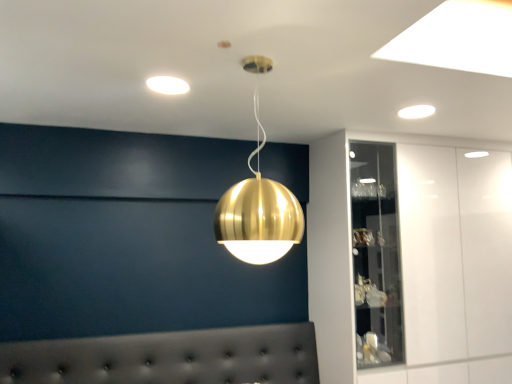
Question: From a real-world perspective, is white glossy cabinet at upper right on top of tufted leather headboard at lower center?

Choices:
 (A) no
 (B) yes

Answer: (B)

Question: Does white glossy cabinet at upper right have a lesser height compared to tufted leather headboard at lower center?

Choices:
 (A) yes
 (B) no

Answer: (B)

Question: Is the position of white glossy cabinet at upper right less distant than that of tufted leather headboard at lower center?

Choices:
 (A) no
 (B) yes

Answer: (A)

Question: From the image's perspective, is white glossy cabinet at upper right over tufted leather headboard at lower center?

Choices:
 (A) no
 (B) yes

Answer: (B)

Question: Is the position of white glossy cabinet at upper right more distant than that of tufted leather headboard at lower center?

Choices:
 (A) yes
 (B) no

Answer: (A)

Question: Would you say gold metallic sphere at center, which is the first lamp from bottom to top, is inside or outside tufted leather headboard at lower center?

Choices:
 (A) inside
 (B) outside

Answer: (B)

Question: Considering the positions of point (268, 226) and point (77, 375), is point (268, 226) closer or farther from the camera than point (77, 375)?

Choices:
 (A) closer
 (B) farther

Answer: (A)

Question: Is gold metallic sphere at center, which is the first lamp from front to back, bigger or smaller than tufted leather headboard at lower center?

Choices:
 (A) big
 (B) small

Answer: (B)

Question: Relative to tufted leather headboard at lower center, is gold metallic sphere at center, which is the first lamp from bottom to top, in front or behind?

Choices:
 (A) front
 (B) behind

Answer: (A)

Question: From their relative heights in the image, would you say white glossy light fixture at upper right, acting as the first lamp starting from the right, is taller or shorter than matte white light fixture at upper center, which is the third lamp from right to left?

Choices:
 (A) tall
 (B) short

Answer: (A)

Question: Is white glossy light fixture at upper right, the first lamp viewed from the back, wider or thinner than matte white light fixture at upper center, which is the third lamp from right to left?

Choices:
 (A) wide
 (B) thin

Answer: (B)

Question: Would you say white glossy light fixture at upper right, acting as the first lamp starting from the right, is to the left or to the right of matte white light fixture at upper center, which is the third lamp from right to left, in the picture?

Choices:
 (A) right
 (B) left

Answer: (A)

Question: Considering their positions, is white glossy light fixture at upper right, which is counted as the 2th lamp, starting from the top, located in front of or behind matte white light fixture at upper center, positioned as the third lamp in bottom-to-top order?

Choices:
 (A) front
 (B) behind

Answer: (B)

Question: Is white glossy cabinet at upper right wider or thinner than white glossy light fixture at upper right, the second lamp when ordered from bottom to top?

Choices:
 (A) wide
 (B) thin

Answer: (A)

Question: Visually, is white glossy cabinet at upper right positioned to the left or to the right of white glossy light fixture at upper right, which is counted as the 2th lamp, starting from the top?

Choices:
 (A) left
 (B) right

Answer: (B)